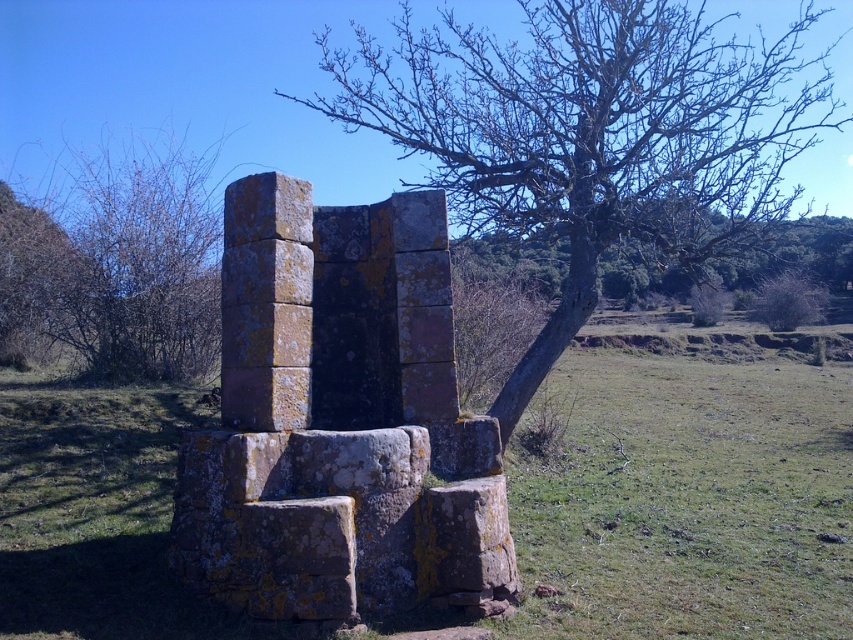
Question: Considering the real-world distances, which object is closest to the bare branches at upper center?

Choices:
 (A) smooth bark tree at center
 (B) brown mossy stone at left

Answer: (A)

Question: Is brown mossy stone at left smaller than bare branches at upper center?

Choices:
 (A) no
 (B) yes

Answer: (B)

Question: Which point is closer to the camera?

Choices:
 (A) smooth bark tree at center
 (B) bare branches at upper center
 (C) brown mossy stone at left

Answer: (A)

Question: Where is smooth bark tree at center located in relation to bare branches at upper center in the image?

Choices:
 (A) right
 (B) left

Answer: (B)

Question: Which point appears farthest from the camera in this image?

Choices:
 (A) (128, 202)
 (B) (753, 288)

Answer: (B)

Question: Does smooth bark tree at center have a lesser width compared to bare branches at upper center?

Choices:
 (A) no
 (B) yes

Answer: (A)